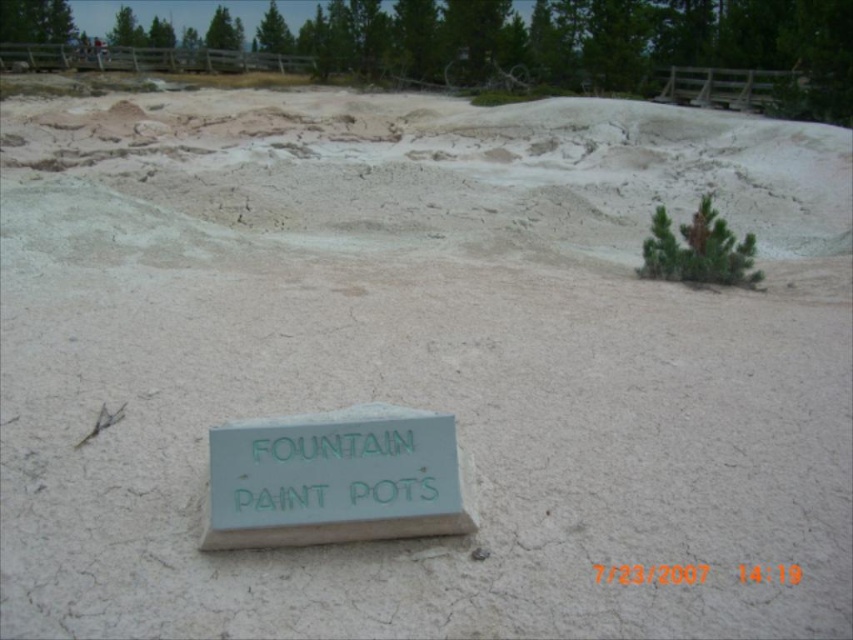
You are standing at the origin point in the image. Which direction should you move to reach the green painted wood sign at lower center?

The green painted wood sign at lower center is located at coordinates point (334, 477), so you should move towards the lower center direction to reach it.

You are a park ranger who needs to place a 4.5 meter long safety rope between the green painted wood sign at lower center and the green leafy pine at upper right. Can you safely secure the rope between these two points without it dragging on the ground?

The distance between the green painted wood sign at lower center and the green leafy pine at upper right is 3.82 meters. Since the rope is 4.5 meters long, it will have enough slack to be secured between the two points without dragging on the ground.

You are standing at the point labeled point (329, 515) and want to walk to the point labeled point (670, 276). Which direction should you move relative to your current position?

You should move towards the upper right direction since point (670, 276) is further away from the viewer compared to your current position at point (329, 515).